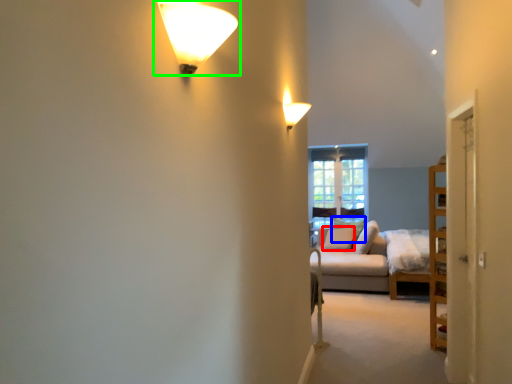
Question: Which object is the farthest from pillow (highlighted by a red box)? Choose among these: pillow (highlighted by a blue box) or lamp (highlighted by a green box).

Choices:
 (A) pillow
 (B) lamp

Answer: (B)